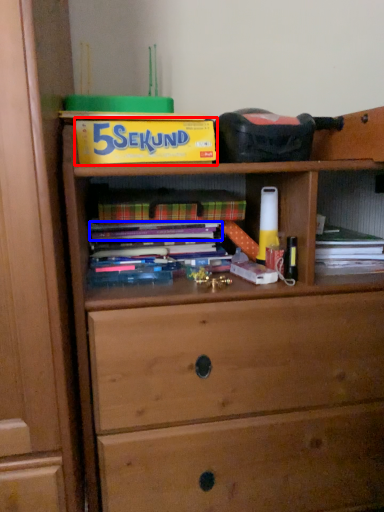
Question: Which object appears farthest to the camera in this image, paperback book (highlighted by a red box) or book (highlighted by a blue box)?

Choices:
 (A) paperback book
 (B) book

Answer: (B)